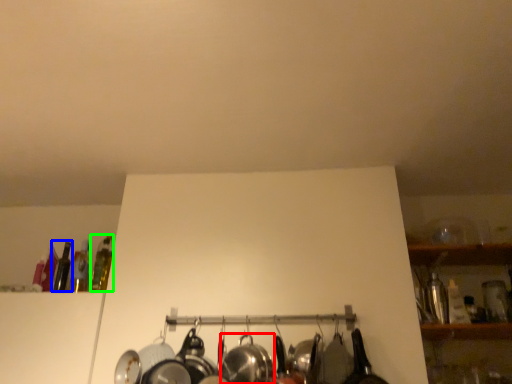
Question: Which object is the farthest from wok (highlighted by a red box)? Choose among these: bottle (highlighted by a blue box) or bottle (highlighted by a green box).

Choices:
 (A) bottle
 (B) bottle

Answer: (A)